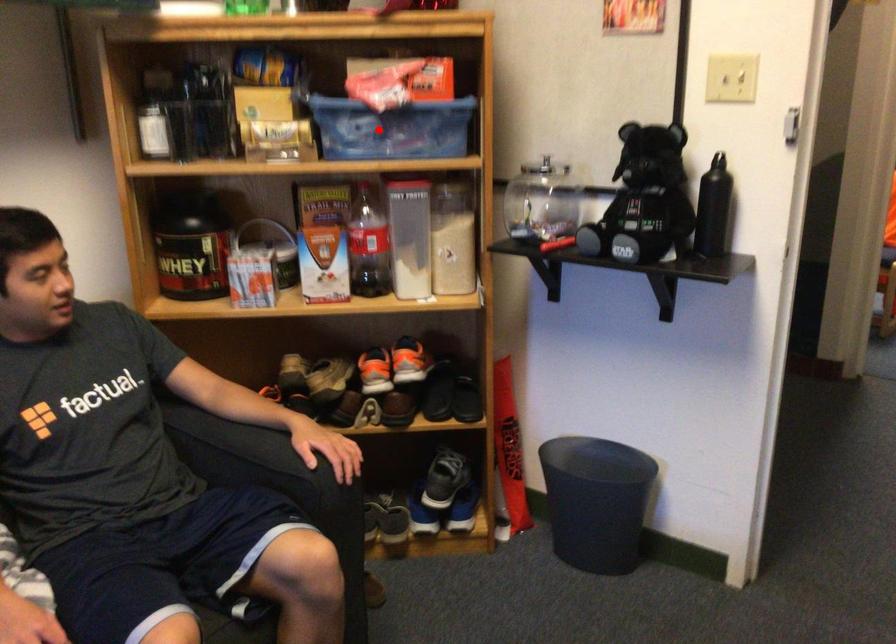
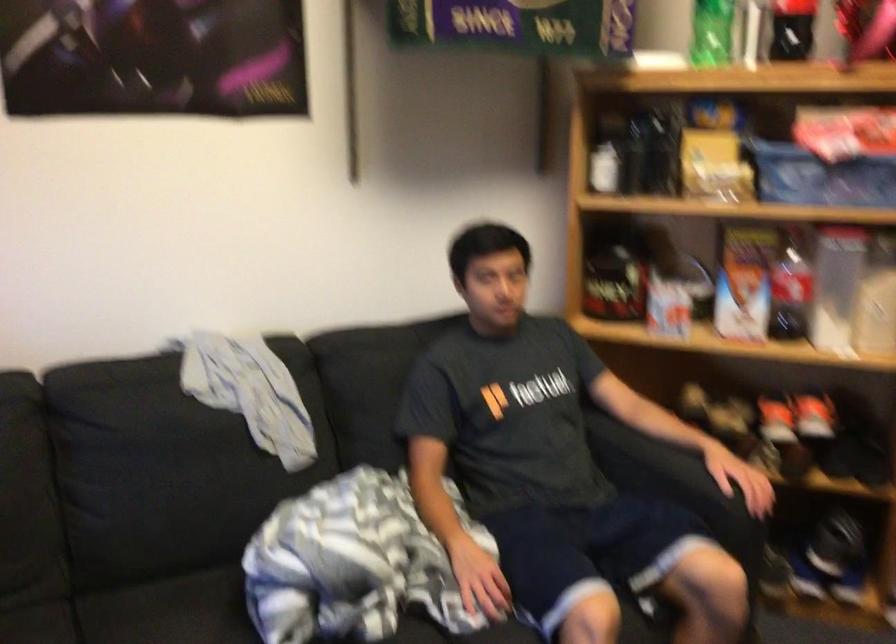
The point at the highlighted location is marked in the first image. Where is the corresponding point in the second image?

(820, 176)